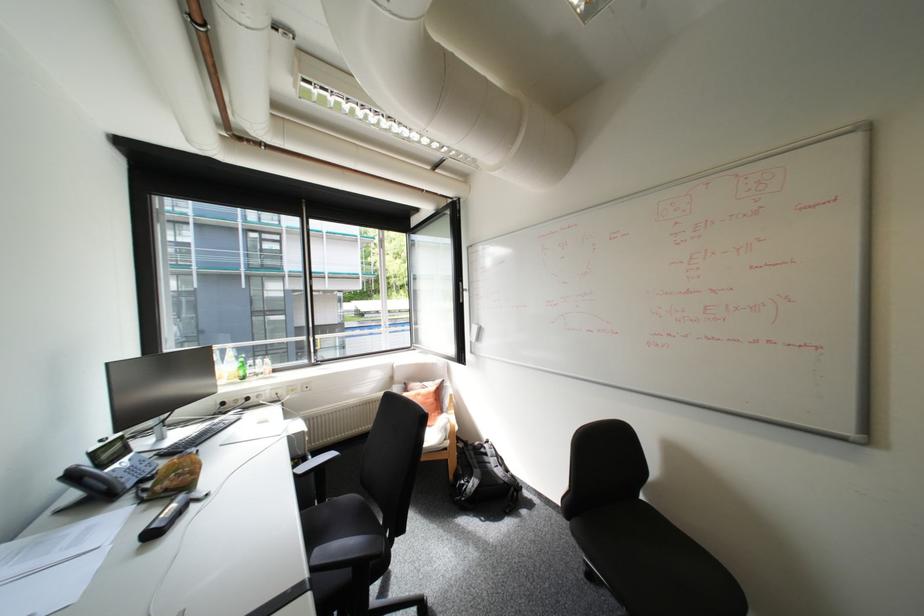
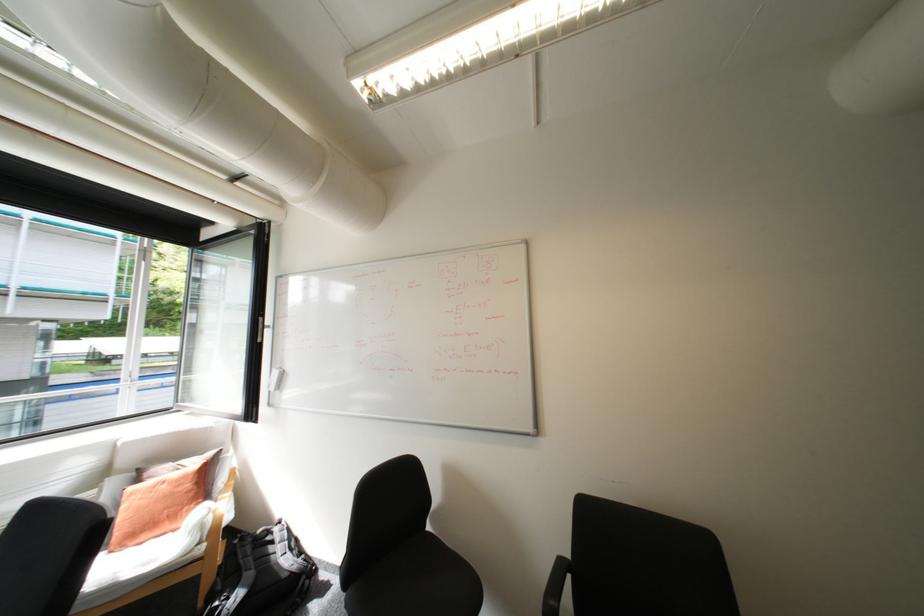
Question: The camera is either moving clockwise (left) or counter-clockwise (right) around the object. The first image is from the beginning of the video and the second image is from the end. Is the camera moving left or right when shooting the video?

Choices:
 (A) Left
 (B) Right

Answer: (A)